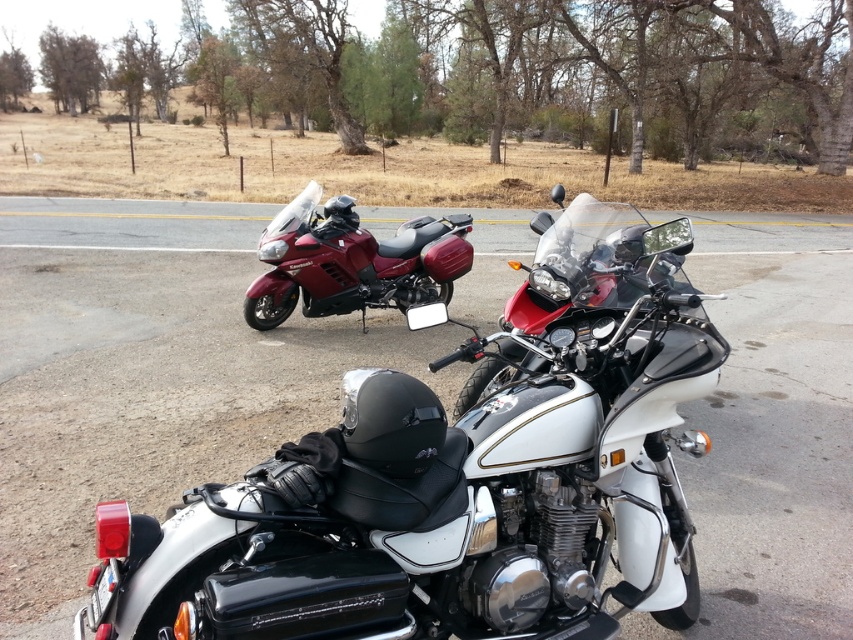
Is white metallic motorcycle at center further to the viewer compared to shiny black motorcycle at center?

Yes, white metallic motorcycle at center is further from the viewer.

Which is more to the right, white metallic motorcycle at center or shiny black motorcycle at center?

Positioned to the right is shiny black motorcycle at center.

Who is more distant from viewer, (4, 205) or (489, 380)?

The point (4, 205) is more distant.

Where is `white metallic motorcycle at center`? white metallic motorcycle at center is located at coordinates (148, 376).

Between point (51, 344) and point (445, 218), which one is positioned behind?

The point (445, 218) is more distant.

Who is taller, white metallic motorcycle at center or glossy red motorcycle at center?

white metallic motorcycle at center

Between point (67, 200) and point (329, 205), which one is positioned behind?

Positioned behind is point (67, 200).

Locate an element on the screen. This screenshot has height=640, width=853. white metallic motorcycle at center is located at coordinates (148, 376).

Does glossy red motorcycle at center appear over shiny black motorcycle at center?

No.

This screenshot has height=640, width=853. Describe the element at coordinates (351, 262) in the screenshot. I see `glossy red motorcycle at center` at that location.

Where is `glossy red motorcycle at center`? glossy red motorcycle at center is located at coordinates (351, 262).